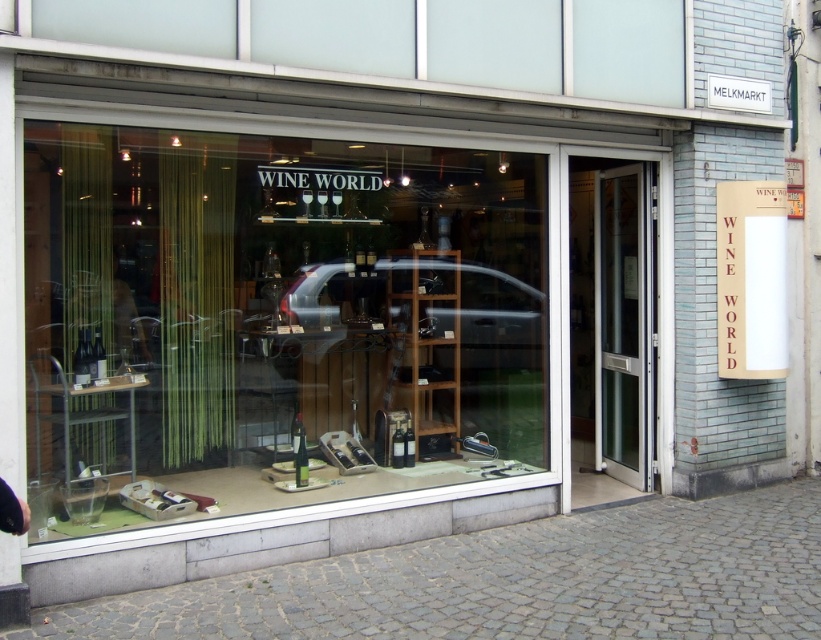
You are a customer standing outside the wine shop entrance. You see the clear glass wine bottles at center and the gray cobblestone pavement at lower center. Which object is taller?

The clear glass wine bottles at center are taller than the gray cobblestone pavement at lower center.

You are standing outside the wine shop looking through the large glass window. There are two points marked on the window at coordinates point (323, 145) and point (571, 426). Which point is closer to you?

Point (323, 145) is closer to the viewer than point (571, 426).